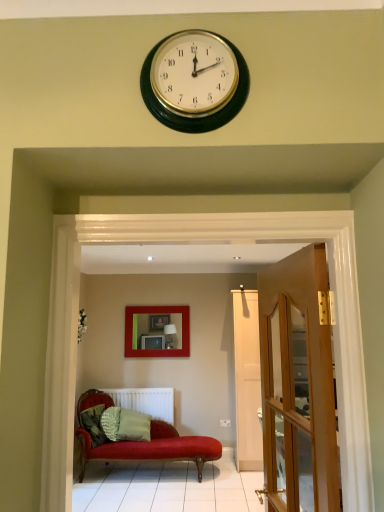
Question: From the image's perspective, is green textured pillow at lower left, which is the second pillow in right-to-left order, located above matte red picture frame at center?

Choices:
 (A) no
 (B) yes

Answer: (A)

Question: From the image's perspective, would you say green textured pillow at lower left, the 1th pillow in the left-to-right sequence, is shown under matte red picture frame at center?

Choices:
 (A) yes
 (B) no

Answer: (A)

Question: Does green textured pillow at lower left, which is the second pillow in right-to-left order, have a larger size compared to matte red picture frame at center?

Choices:
 (A) yes
 (B) no

Answer: (B)

Question: From a real-world perspective, is green textured pillow at lower left, which is the second pillow in right-to-left order, under matte red picture frame at center?

Choices:
 (A) yes
 (B) no

Answer: (A)

Question: From a real-world perspective, is green textured pillow at lower left, which is the second pillow in right-to-left order, positioned over matte red picture frame at center based on gravity?

Choices:
 (A) no
 (B) yes

Answer: (A)

Question: Based on their positions, is green textured pillow at lower left, which is the second pillow in right-to-left order, located to the left or right of green textured pillow at center, positioned as the 2th pillow in left-to-right order?

Choices:
 (A) left
 (B) right

Answer: (A)

Question: Does point (86, 430) appear closer or farther from the camera than point (140, 432)?

Choices:
 (A) farther
 (B) closer

Answer: (B)

Question: Considering the positions of green textured pillow at lower left, which is the second pillow in right-to-left order, and green textured pillow at center, the first pillow viewed from the right, in the image, is green textured pillow at lower left, which is the second pillow in right-to-left order, taller or shorter than green textured pillow at center, the first pillow viewed from the right,?

Choices:
 (A) tall
 (B) short

Answer: (B)

Question: Would you say green textured pillow at lower left, which is the second pillow in right-to-left order, is inside or outside green textured pillow at center, the first pillow viewed from the right?

Choices:
 (A) inside
 (B) outside

Answer: (B)

Question: Is point (102, 433) closer or farther from the camera than point (172, 395)?

Choices:
 (A) farther
 (B) closer

Answer: (B)

Question: Based on their positions, is green textured pillow at lower left, the 1th pillow in the left-to-right sequence, located to the left or right of white matte radiator at lower center?

Choices:
 (A) left
 (B) right

Answer: (A)

Question: From their relative heights in the image, would you say green textured pillow at lower left, the 1th pillow in the left-to-right sequence, is taller or shorter than white matte radiator at lower center?

Choices:
 (A) short
 (B) tall

Answer: (A)

Question: From the image's perspective, is green textured pillow at lower left, which is the second pillow in right-to-left order, located above or below white matte radiator at lower center?

Choices:
 (A) above
 (B) below

Answer: (A)

Question: Visually, is matte red picture frame at center positioned to the left or to the right of green textured pillow at lower left, which is the second pillow in right-to-left order?

Choices:
 (A) left
 (B) right

Answer: (B)

Question: Considering the positions of matte red picture frame at center and green textured pillow at lower left, which is the second pillow in right-to-left order, in the image, is matte red picture frame at center taller or shorter than green textured pillow at lower left, which is the second pillow in right-to-left order,?

Choices:
 (A) short
 (B) tall

Answer: (B)